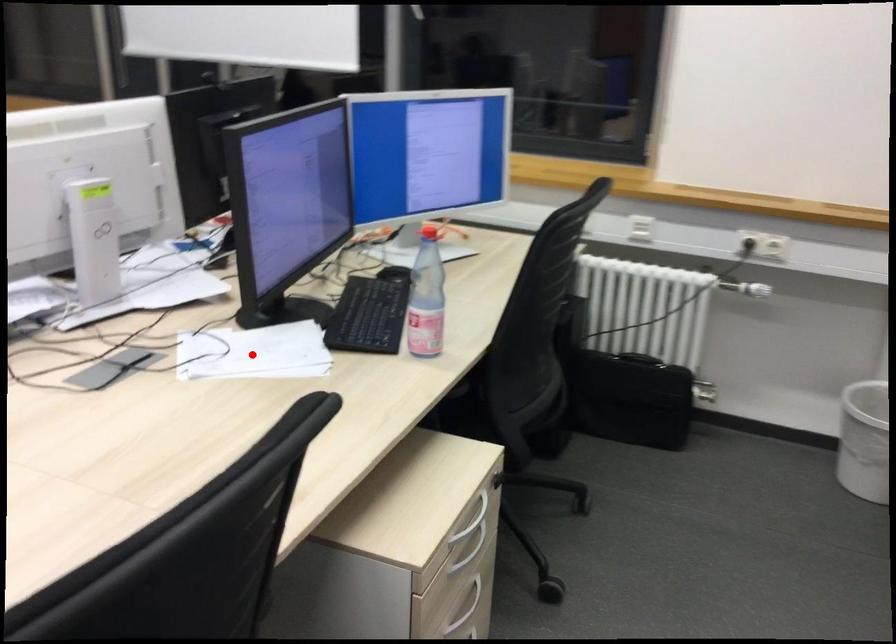
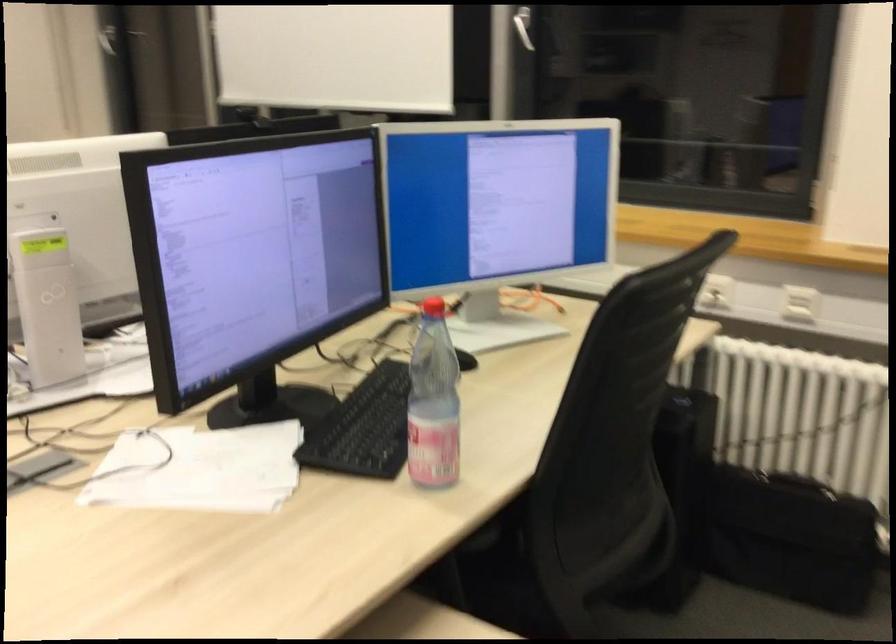
The point at the highlighted location is marked in the first image. Where is the corresponding point in the second image?

(199, 469)